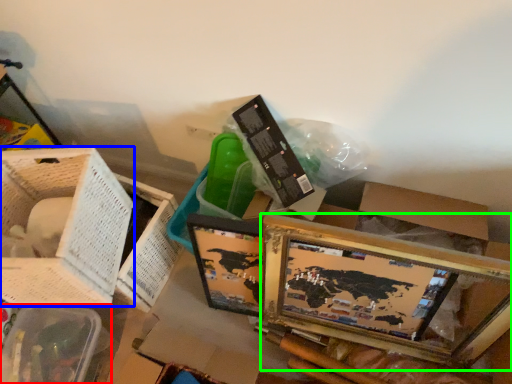
Question: Which object is the farthest from basket (highlighted by a red box)? Choose among these: basket (highlighted by a blue box) or picture frame (highlighted by a green box).

Choices:
 (A) basket
 (B) picture frame

Answer: (B)